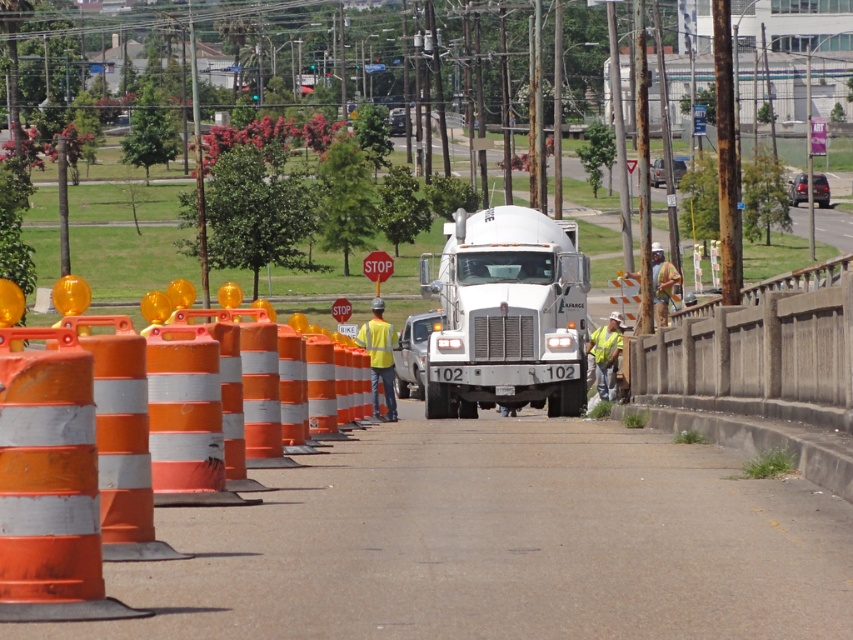
You are a pedestrian trying to cross the road where the construction is happening. You see both the yellow reflective vest at center and the yellow reflective safety vest at center. Which one is closer to the ground?

The yellow reflective vest at center is positioned under the yellow reflective safety vest at center, so the yellow reflective vest at center is closer to the ground.

You are a driver approaching the construction site. You see an orange reflective cone at left and a white matte trailer truck at center. Which object is bigger in size?

The orange reflective cone at left is larger in size than the white matte trailer truck at center.